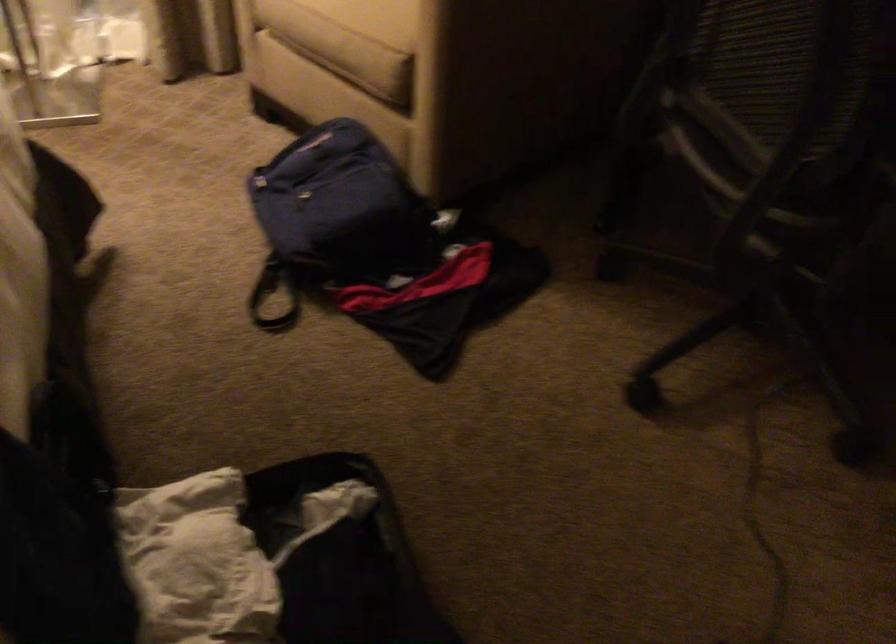
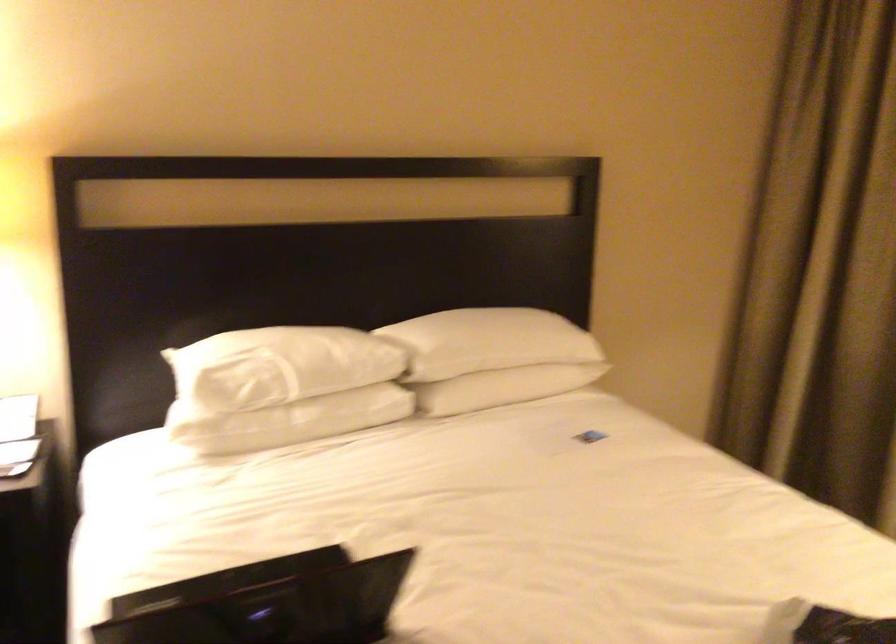
Question: The camera is either moving clockwise (left) or counter-clockwise (right) around the object. The first image is from the beginning of the video and the second image is from the end. Is the camera moving left or right when shooting the video?

Choices:
 (A) Left
 (B) Right

Answer: (B)